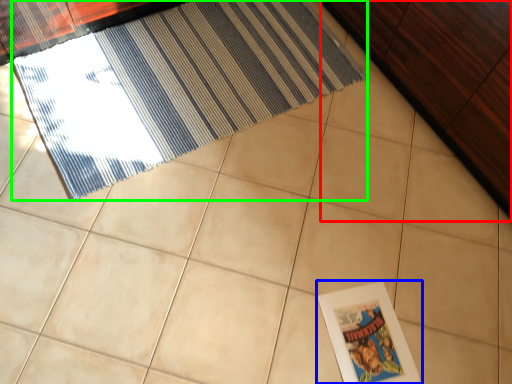
Question: Which is farther away from dresser (highlighted by a red box)? picture frame (highlighted by a blue box) or door (highlighted by a green box)?

Choices:
 (A) picture frame
 (B) door

Answer: (A)